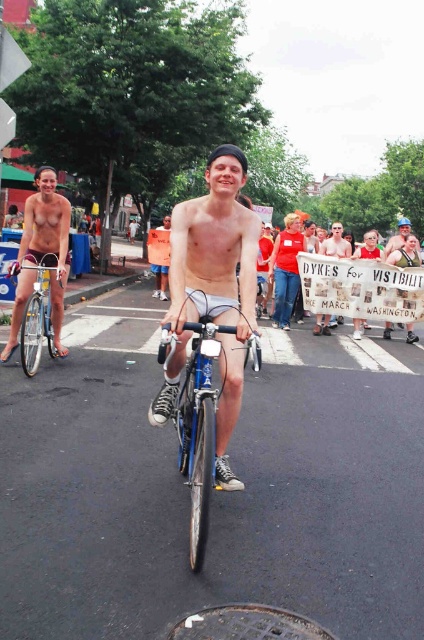
You are a photographer trying to capture a photo of the matte skin nude woman at left and the silver metallic bicycle at left. Based on their heights, which one should you focus on first to ensure they are both in frame?

The matte skin nude woman at left is taller than the silver metallic bicycle at left, so you should focus on the matte skin nude woman at left first to ensure both are in frame.

From the picture: You are a photographer trying to capture the matte skin nude woman at left and the silver metallic bicycle at left in a single shot. Based on their positions, can you tell which one is higher in the frame?

The matte skin nude woman at left is above the silver metallic bicycle at left, so she is higher in the frame.

What object is located at the coordinates point (404, 250)?

The object located at point (404, 250) is the matte white sign at center.